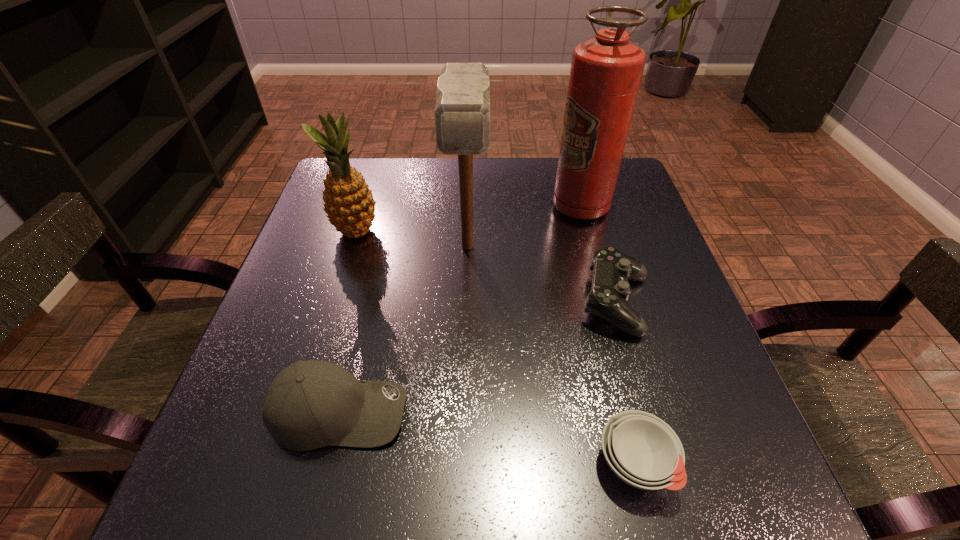
Identify the location of vacant space at the far right corner of the desktop. Image resolution: width=960 pixels, height=540 pixels. (626, 201).

Where is `free point between the pineapple and the baseball cap`? free point between the pineapple and the baseball cap is located at coordinates (348, 322).

At what (x,y) coordinates should I click in order to perform the action: click on vacant area that lies between the fourth shortest object and the baseball cap. Please return your answer as a coordinate pair (x, y). The height and width of the screenshot is (540, 960). Looking at the image, I should click on (348, 322).

I want to click on free space between the second shortest object and the third object from left to right, so click(x=541, y=275).

Locate an element on the screen. The height and width of the screenshot is (540, 960). free spot between the control and the shortest object is located at coordinates (625, 383).

Where is `free area in between the shortest object and the baseball cap`? The height and width of the screenshot is (540, 960). free area in between the shortest object and the baseball cap is located at coordinates (487, 437).

Where is `vacant area that lies between the control and the pineapple`? The image size is (960, 540). vacant area that lies between the control and the pineapple is located at coordinates (486, 268).

At what (x,y) coordinates should I click in order to perform the action: click on free space between the mallet and the soup bowl. Please return your answer as a coordinate pair (x, y). Looking at the image, I should click on (551, 354).

Find the location of a particular element. This screenshot has height=540, width=960. unoccupied area between the fire extinguisher and the shortest object is located at coordinates (608, 334).

You are a GUI agent. You are given a task and a screenshot of the screen. Output one action in this format:
    pyautogui.click(x=<x>, y=<y>)
    Task: Click on the second closest object to the third shortest object
    This screenshot has width=960, height=540.
    Given the screenshot: What is the action you would take?
    pyautogui.click(x=642, y=450)